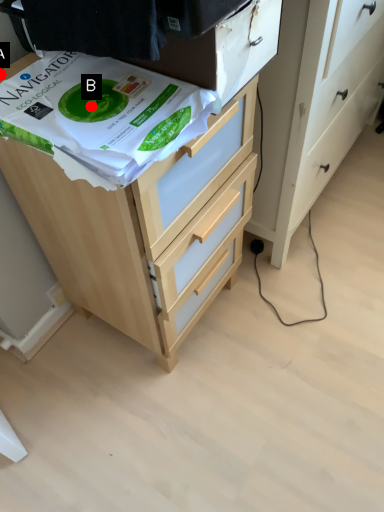
Question: Two points are circled on the image, labeled by A and B beside each circle. Which point is farther to the camera?

Choices:
 (A) A is further
 (B) B is further

Answer: (A)